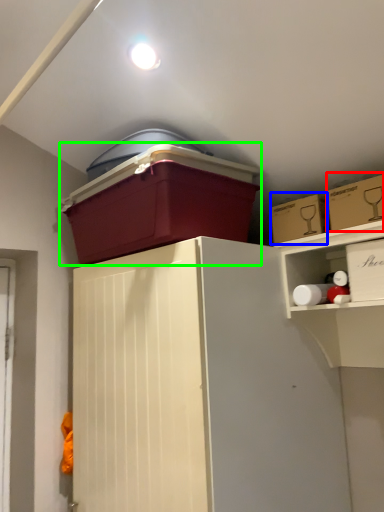
Question: Which object is positioned closest to storage box (highlighted by a red box)? Select from storage box (highlighted by a blue box) and storage box (highlighted by a green box).

Choices:
 (A) storage box
 (B) storage box

Answer: (A)